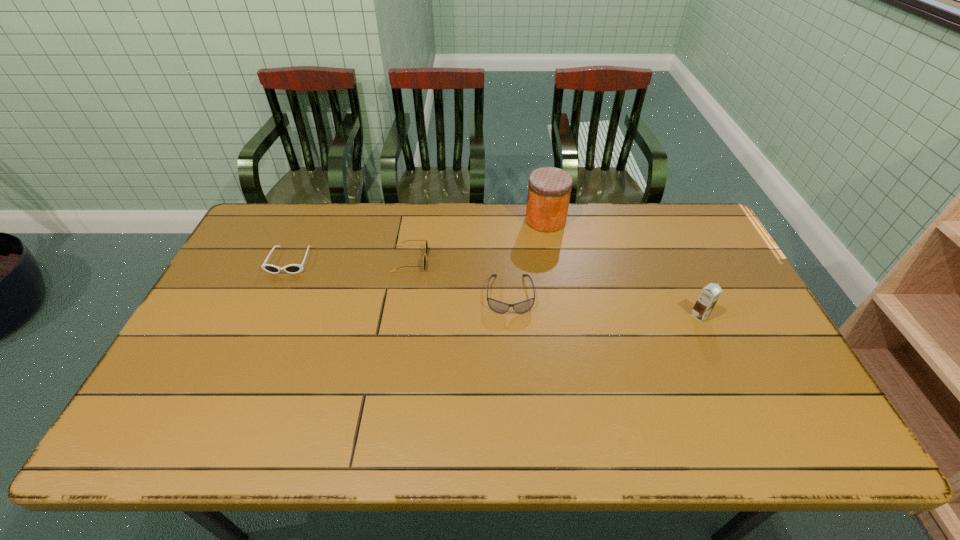
The width and height of the screenshot is (960, 540). Find the location of `jar`. jar is located at coordinates (549, 190).

Identify the location of the fourth object from left to right. (549, 190).

Identify the location of the second tallest object. (709, 295).

Where is `chocolate milk`? This screenshot has width=960, height=540. chocolate milk is located at coordinates (709, 295).

Image resolution: width=960 pixels, height=540 pixels. Identify the location of the rightmost sunglasses. (497, 306).

This screenshot has height=540, width=960. I want to click on the nearest sunglasses, so click(497, 306).

At what (x,y) coordinates should I click in order to perform the action: click on the second sunglasses from right to left. Please return your answer as a coordinate pair (x, y). The image size is (960, 540). Looking at the image, I should click on (426, 244).

The image size is (960, 540). I want to click on the leftmost sunglasses, so click(292, 268).

Image resolution: width=960 pixels, height=540 pixels. In order to click on vacant space located 0.320m on the front of the tallest object in this screenshot , I will do `click(560, 303)`.

This screenshot has height=540, width=960. What are the coordinates of `free space located 0.080m on the back of the chocolate milk` in the screenshot? It's located at (687, 289).